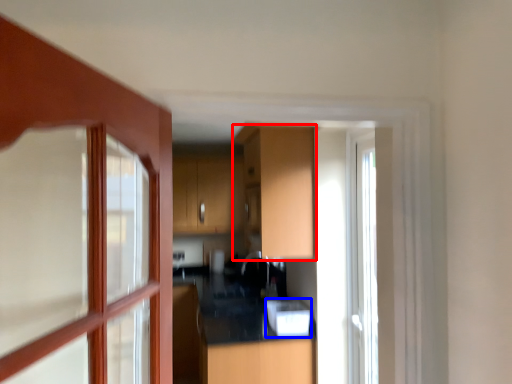
Question: Which point is closer to the camera, cabinetry (highlighted by a red box) or appliance (highlighted by a blue box)?

Choices:
 (A) cabinetry
 (B) appliance

Answer: (A)